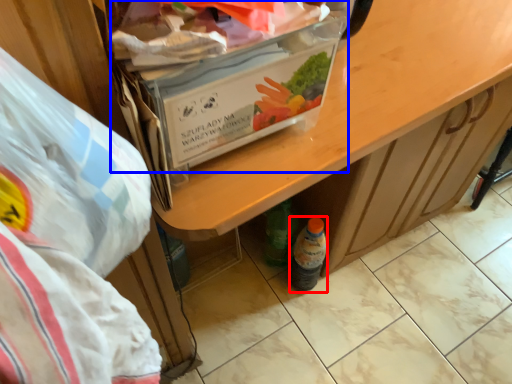
Question: Which object is closer to the camera taking this photo, bottle (highlighted by a red box) or box (highlighted by a blue box)?

Choices:
 (A) bottle
 (B) box

Answer: (B)